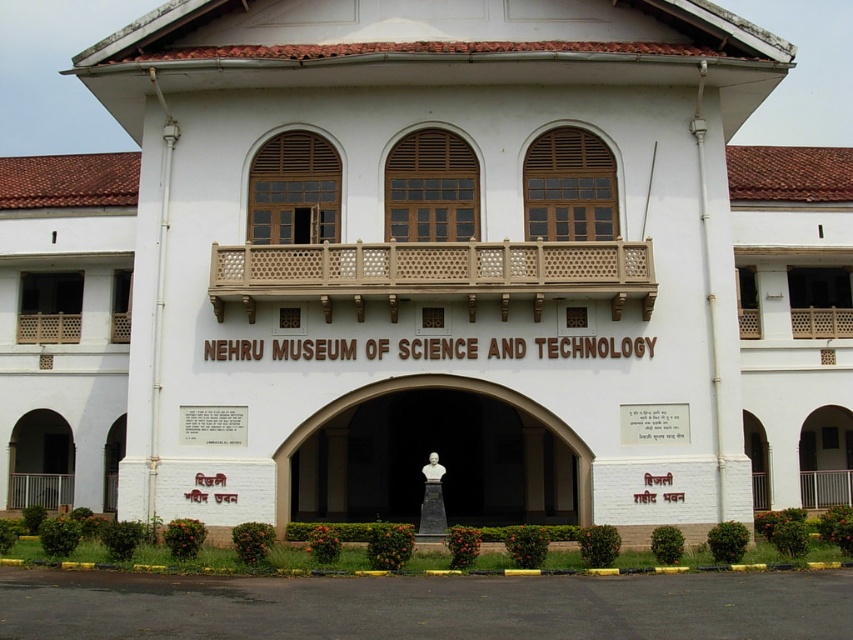
What do you see at coordinates (424, 388) in the screenshot? I see `white marble bust at center` at bounding box center [424, 388].

Is white marble bust at center closer to the viewer compared to black marble bust at center?

Yes, it is.

What are the coordinates of `white marble bust at center` in the screenshot? It's located at (424, 388).

Where is `white marble bust at center`? The height and width of the screenshot is (640, 853). white marble bust at center is located at coordinates (424, 388).